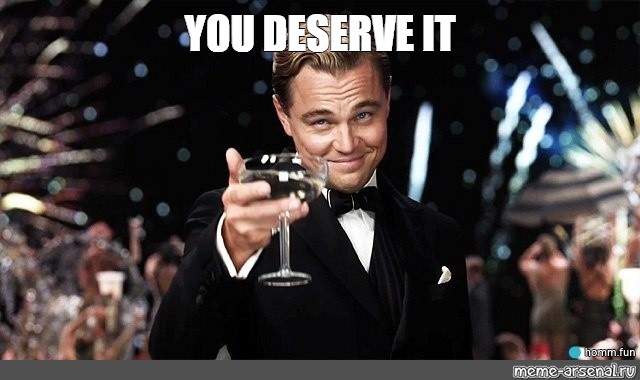
What are the coordinates of `wine glass` in the screenshot? It's located at (276, 169).